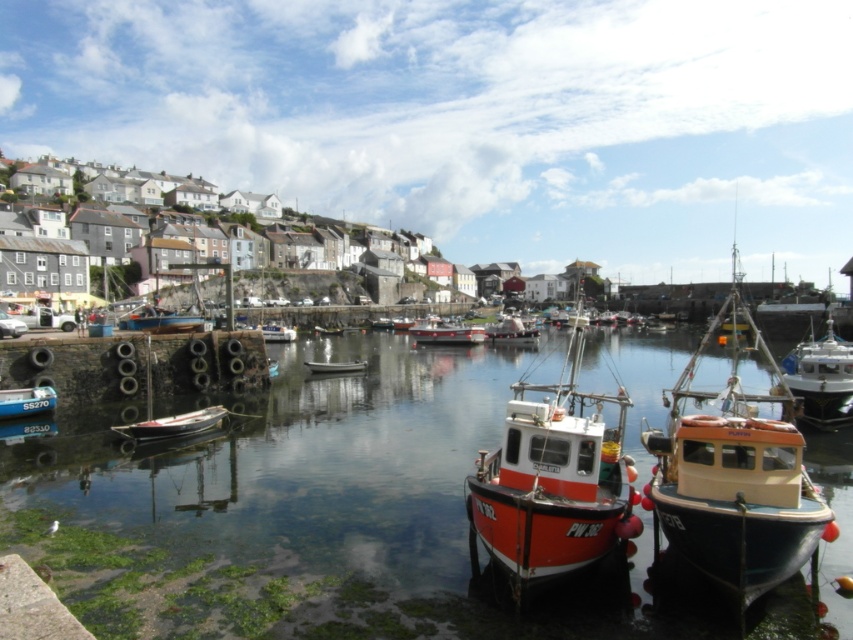
You are a dock worker who needs to load a crate onto the blue wooden boat at center and the white plastic boat at center. Which boat requires a smaller crane due to its size?

The blue wooden boat at center requires a smaller crane because it has a smaller size compared to the white plastic boat at center.

You are standing at the edge of the harbor and want to locate the clear water at center. According to the coordinates provided, where exactly should you look?

The clear water at center is located at point coordinates of 0.805 on the x axis and 0.369 on the y axis.

Based on the photo, you are a marine biologist studying water levels in the harbor. You observe the clear water at center and the blue wooden boat at center. Which object has a greater height in this scene?

The clear water at center is taller than the blue wooden boat at center according to the description.